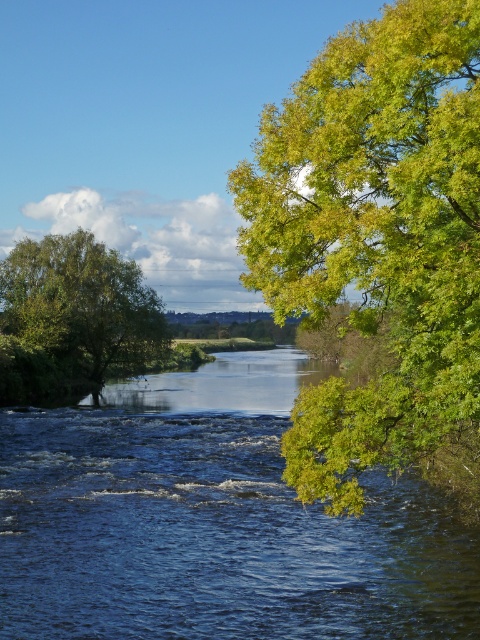
You are standing at the bottom left corner of the image. You want to walk directly towards the blue water at center. Which direction should you move? Please answer with either left, right, forward, backward, or a combination of these directions separated by commas.

The blue water at center is located at point 0.817 on the x axis and 0.446 on the y axis. Since you are at the bottom left corner, moving forward would increase your x and y coordinates. To reach the blue water at center, you should move forward and slightly to the right.

You are standing at the riverside and want to take a photo of the blue water at center and the green leafy tree at right. Which object should you frame first in your camera to ensure both are in the shot?

The blue water at center should be framed first because it is positioned on the left side of the green leafy tree at right, so capturing the left side object first ensures both are included in the frame.

You are standing at the riverside and want to take a photo of both the blue water at center and the green leafy tree at left. Which object should you focus on first if you want to capture both in one frame without moving your camera?

You should focus on the green leafy tree at left first because it is taller than the blue water at center, so adjusting the camera angle to include its height will naturally include the water in the foreground.